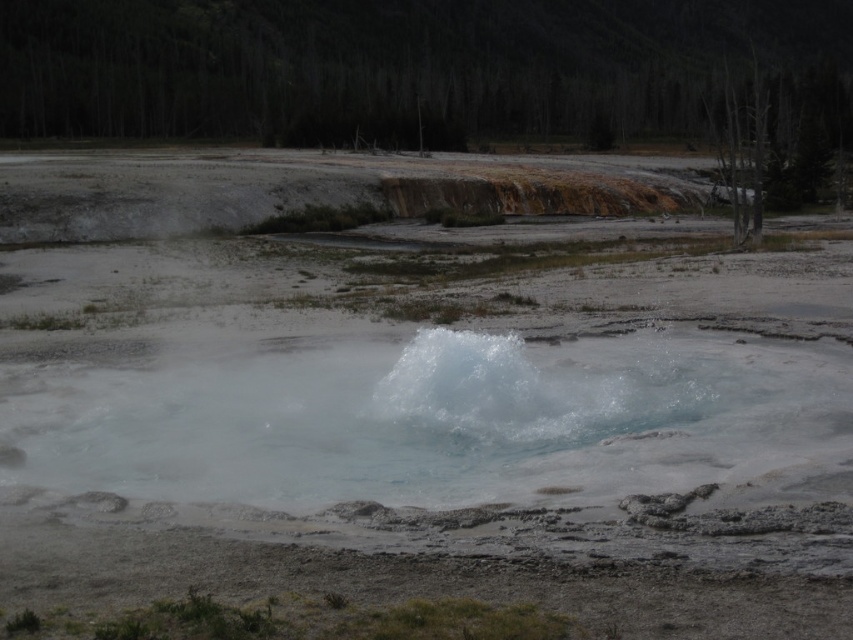
You are a geologist standing near the bubbling pool in the geothermal area. You need to collect a sample of the translucent white water at center and the translucent water vapor at center. Which one is closer to your current position?

The translucent white water at center is 9.14 feet away from the translucent water vapor at center. Since the question asks which is closer to your current position, but the distance between them is provided, we need to clarify that without knowing your exact position relative to both, we can only state their separation. However, assuming you are at the point where the distance is measured from, the vapor would be 9.14 feet away from the water. But the question might be interpreted as which is nearer to you

You are a geologist observing the geothermal area. You notice the translucent white water at center and the translucent water vapor at center. Which one is higher in elevation?

The translucent white water at center has a greater height compared to the translucent water vapor at center, so the translucent white water at center is higher in elevation.

You are a geologist examining the geothermal area. You observe the translucent white water at center and the translucent water vapor at center. Which of these two is bigger in size?

The translucent white water at center is larger in size than the translucent water vapor at center.